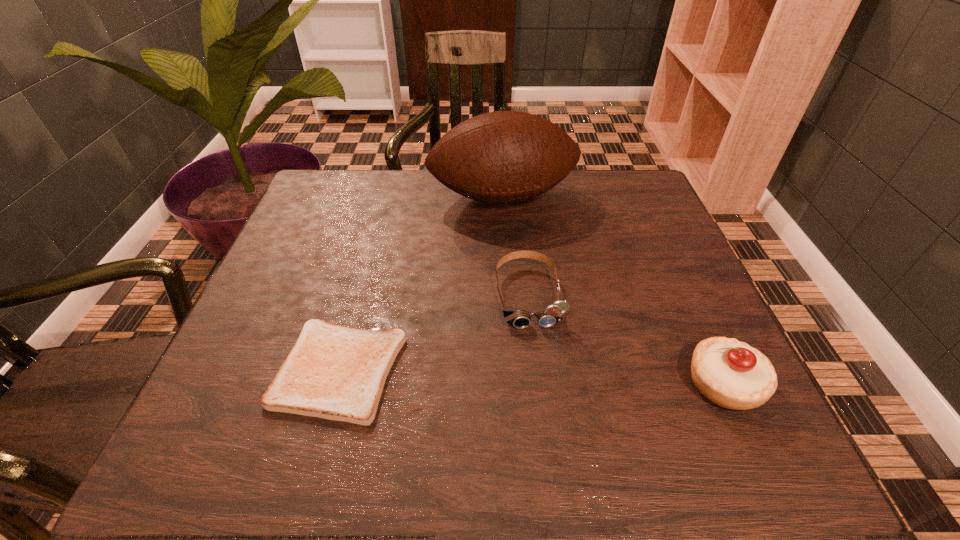
In order to click on vacant space at the left edge of the desktop in this screenshot , I will do `click(314, 222)`.

In the image, there is a desktop. Where is `vacant space at the right edge`? The width and height of the screenshot is (960, 540). vacant space at the right edge is located at coordinates (684, 327).

In the image, there is a desktop. At what (x,y) coordinates should I click in order to perform the action: click on free space at the far left corner. Please return your answer as a coordinate pair (x, y). This screenshot has width=960, height=540. Looking at the image, I should click on (342, 176).

Locate an element on the screen. This screenshot has height=540, width=960. free point at the near left corner is located at coordinates (255, 383).

Identify the location of free location at the far right corner of the desktop. (611, 188).

Where is `free space between the rightmost object and the shortest object`? This screenshot has width=960, height=540. free space between the rightmost object and the shortest object is located at coordinates (532, 377).

Find the location of a particular element. empty space that is in between the leftmost object and the second shortest object is located at coordinates (434, 333).

Find the location of a particular element. free spot between the goggles and the rightmost object is located at coordinates (626, 339).

I want to click on free point between the football and the leftmost object, so click(x=421, y=284).

You are a GUI agent. You are given a task and a screenshot of the screen. Output one action in this format:
    pyautogui.click(x=<x>, y=<y>)
    Task: Click on the free space between the farthest object and the pastry
    Image resolution: width=960 pixels, height=540 pixels.
    Given the screenshot: What is the action you would take?
    pyautogui.click(x=613, y=291)